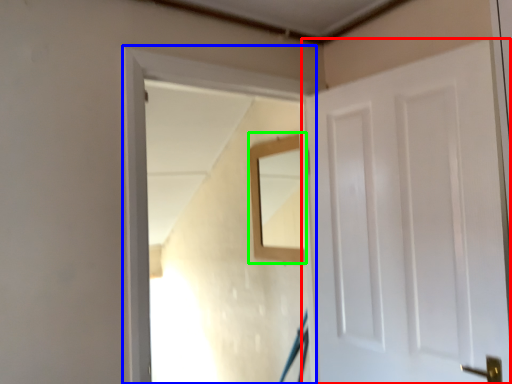
Question: Considering the real-world distances, which object is farthest from door (highlighted by a red box)? window frame (highlighted by a blue box) or mirror (highlighted by a green box)?

Choices:
 (A) window frame
 (B) mirror

Answer: (B)